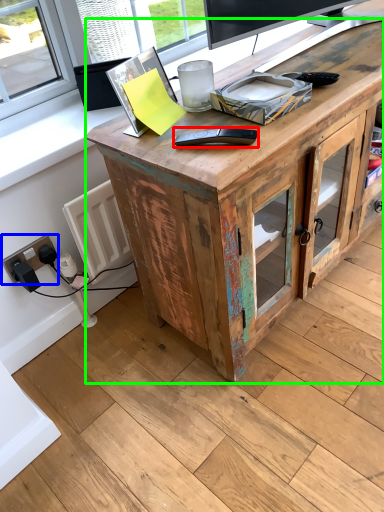
Question: Considering the real-world distances, which object is farthest from equipment (highlighted by a red box)? electric outlet (highlighted by a blue box) or desk (highlighted by a green box)?

Choices:
 (A) electric outlet
 (B) desk

Answer: (A)